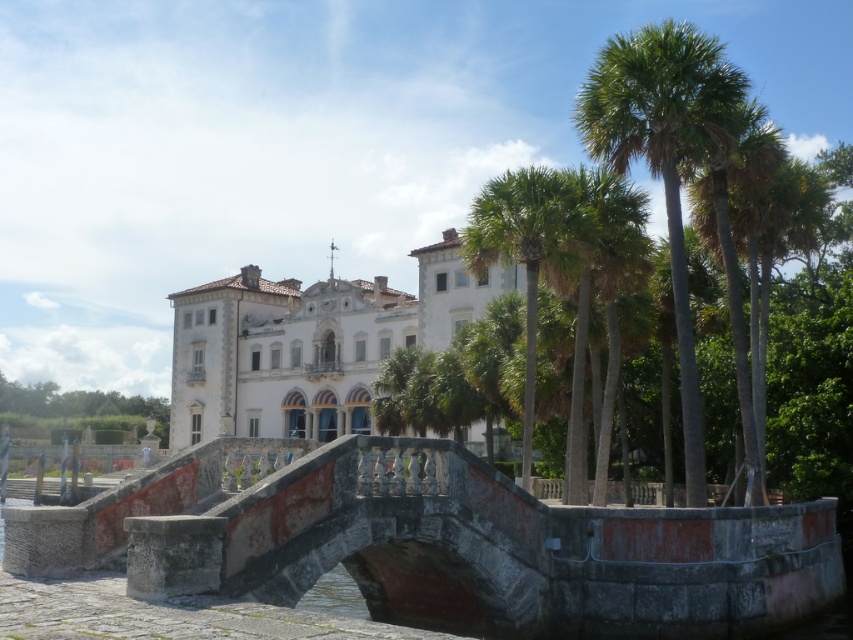
You are a visitor approaching the mansion and notice the rustic stone bridge at center and the green leafy palm trees at right. Which structure appears taller from your viewpoint?

The green leafy palm trees at right are taller than the rustic stone bridge at center, so they appear taller from your viewpoint.

You are standing at the point marked as point (437, 544) in the image. Describe your immediate surroundings based on the scene description provided.

You are standing on the rustic stone bridge at center, which is leading towards the grand historic mansion surrounded by lush greenery under a bright blue sky.